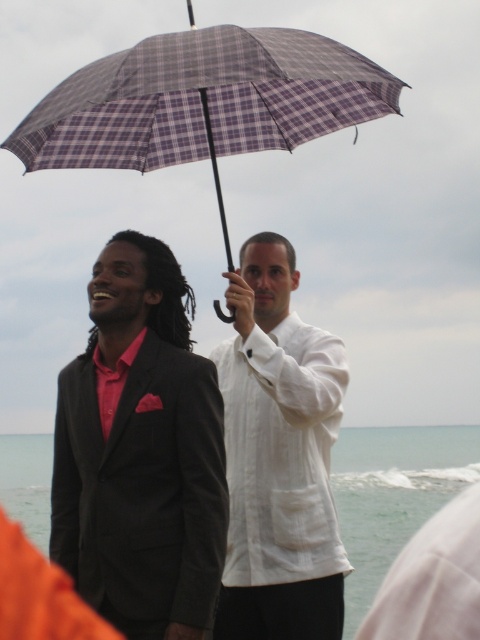
You are a photographer trying to capture a wide shot of the scene. You need to ensure both the matte black suit at left and the plaid fabric umbrella at center are fully visible in the frame. Considering their sizes, which object might require you to adjust your camera angle to avoid cropping?

The matte black suit at left is wider than the plaid fabric umbrella at center, so you might need to adjust your camera angle to ensure the entire width of the matte black suit at left is captured without cropping.